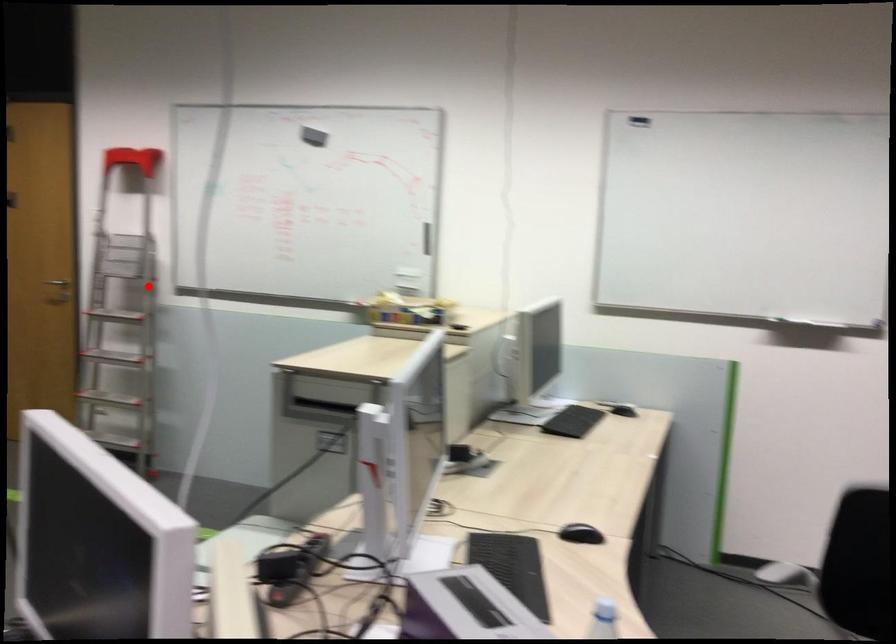
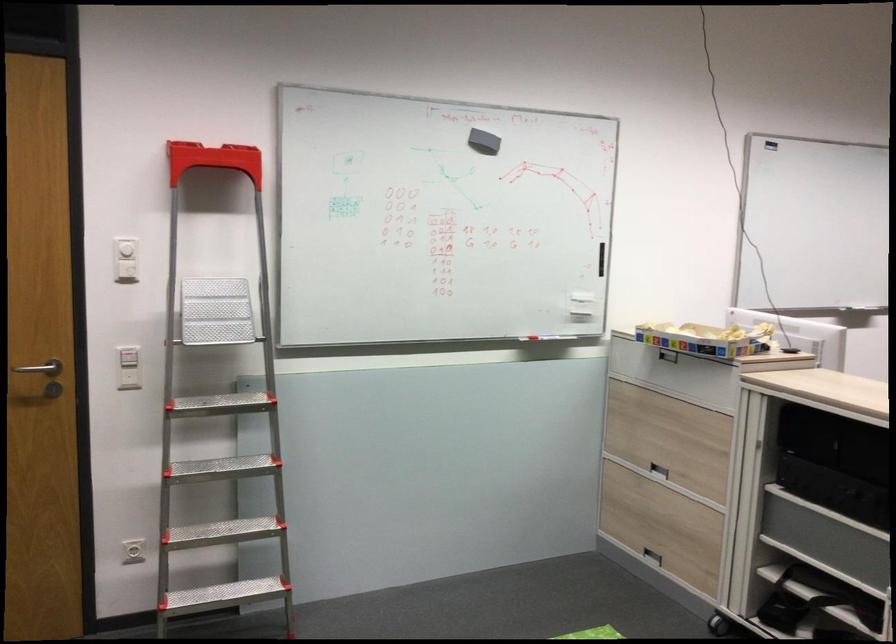
Where in the second image is the point corresponding to the highlighted location from the first image?

(128, 377)